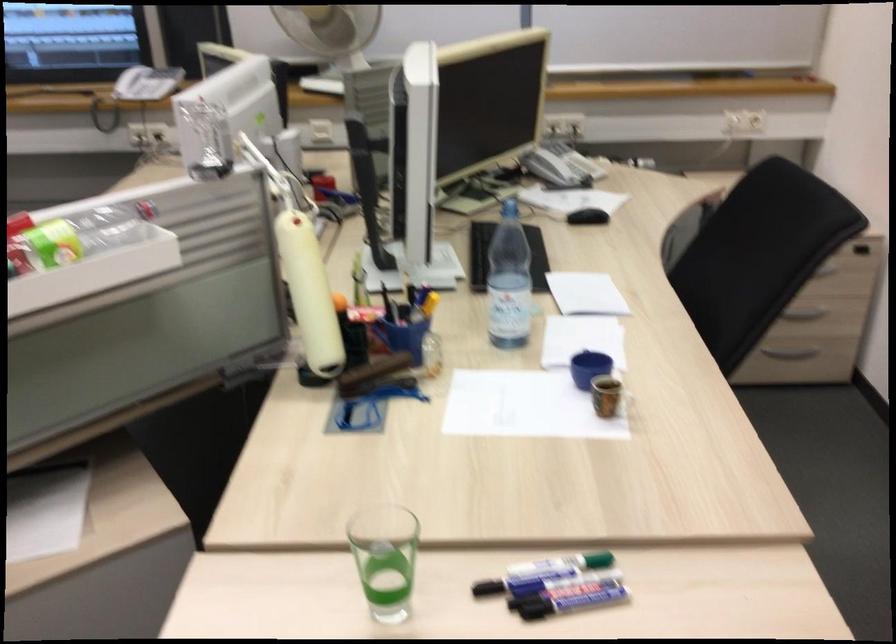
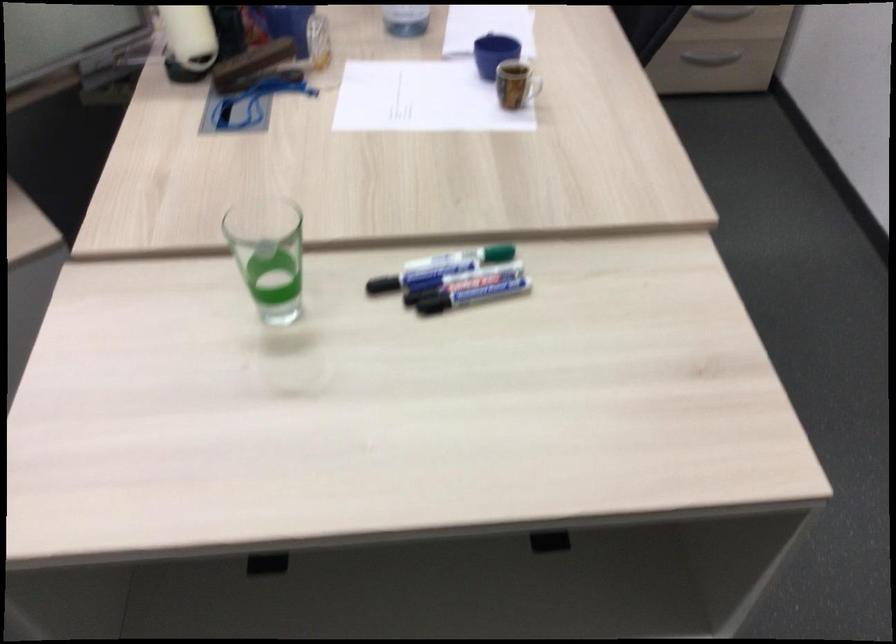
The point at (x=591, y=365) is marked in the first image. Where is the corresponding point in the second image?

(494, 53)